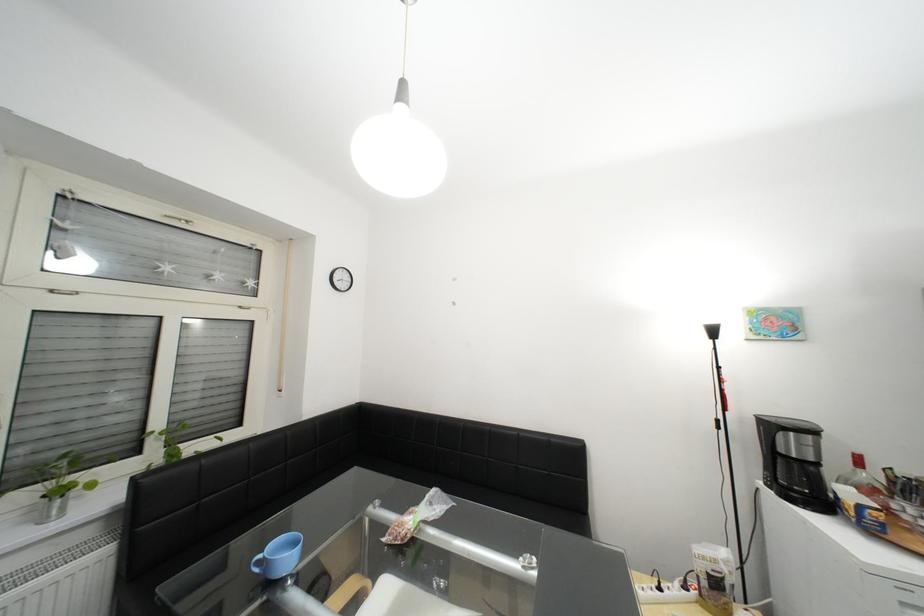
Image resolution: width=924 pixels, height=616 pixels. Describe the element at coordinates (540, 513) in the screenshot. I see `the sofa sitting surface` at that location.